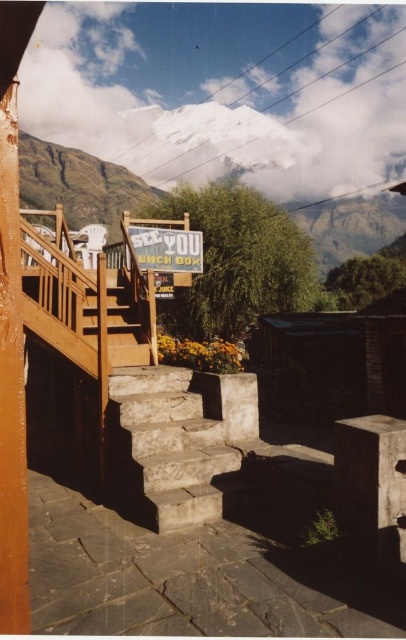
Question: Which object appears farthest from the camera in this image?

Choices:
 (A) wooden stairs at center
 (B) stone textured stairs at center

Answer: (A)

Question: Does stone textured stairs at center come behind wooden stairs at center?

Choices:
 (A) yes
 (B) no

Answer: (B)

Question: Does stone textured stairs at center appear over wooden stairs at center?

Choices:
 (A) no
 (B) yes

Answer: (A)

Question: Can you confirm if stone textured stairs at center is positioned to the left of wooden stairs at center?

Choices:
 (A) yes
 (B) no

Answer: (B)